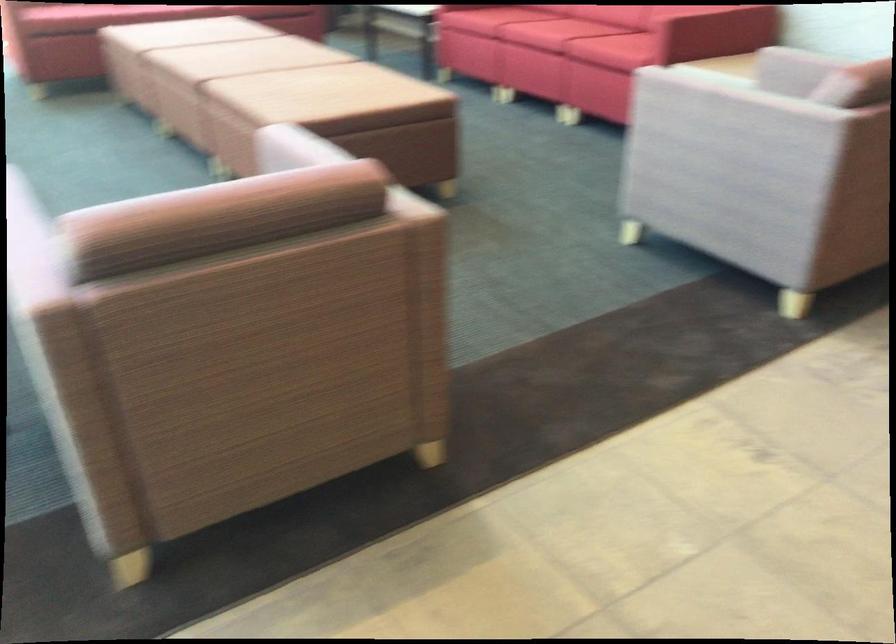
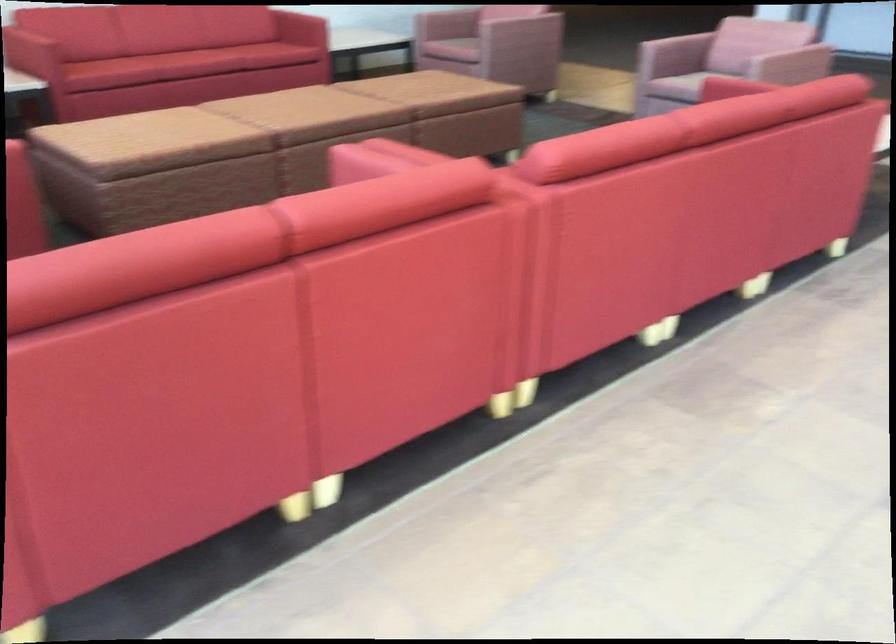
First-person continuous shooting, in which direction is the camera rotating?

The camera rotated toward right-down.